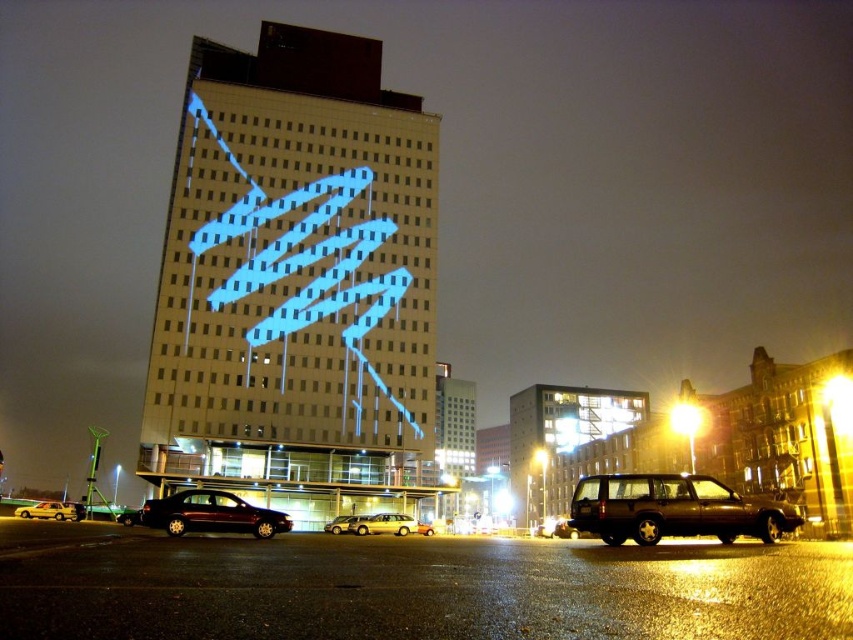
Question: Does metallic silver station wagon at center appear over white glossy sedan at lower left?

Choices:
 (A) no
 (B) yes

Answer: (A)

Question: Which object is the closest to the dark brown matte suv at lower right?

Choices:
 (A) shiny gold suv at center
 (B) white glossy sedan at lower left

Answer: (A)

Question: Which point appears farthest from the camera in this image?

Choices:
 (A) (553, 534)
 (B) (349, 522)
 (C) (358, 534)

Answer: (A)

Question: Can you confirm if shiny maroon sedan at lower left is bigger than metallic silver sedan at center?

Choices:
 (A) yes
 (B) no

Answer: (A)

Question: Among these objects, which one is farthest from the camera?

Choices:
 (A) shiny maroon sedan at lower left
 (B) shiny gold suv at center
 (C) dark brown matte suv at lower right
 (D) white glossy sedan at lower left

Answer: (D)

Question: Observing the image, what is the correct spatial positioning of metallic silver station wagon at center in reference to metallic silver sedan at center?

Choices:
 (A) below
 (B) above

Answer: (B)